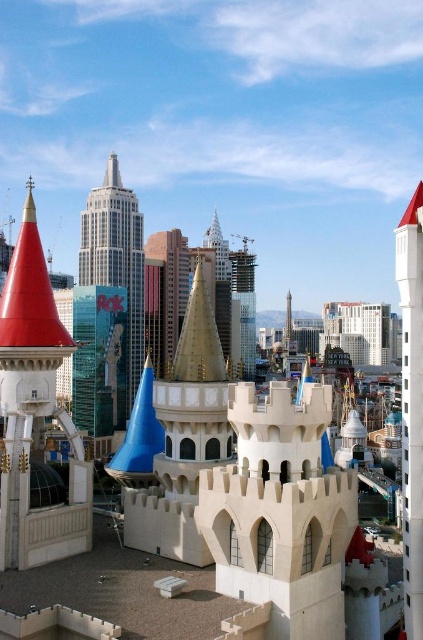
Which of these two, red matte cone at upper left or clear glass tower at center, stands taller?

Standing taller between the two is clear glass tower at center.

This screenshot has height=640, width=423. Find the location of `red matte cone at upper left`. red matte cone at upper left is located at coordinates (35, 410).

Can you confirm if white concrete tower at right is positioned above clear glass tower at center?

Incorrect, white concrete tower at right is not positioned above clear glass tower at center.

Measure the distance between white concrete tower at right and camera.

The distance of white concrete tower at right from camera is 152.07 feet.

Where is `white concrete tower at right`? This screenshot has height=640, width=423. white concrete tower at right is located at coordinates (412, 404).

Does red matte cone at upper left have a lesser height compared to white glass skyscraper at center?

Indeed, red matte cone at upper left has a lesser height compared to white glass skyscraper at center.

Locate an element on the screen. Image resolution: width=423 pixels, height=640 pixels. red matte cone at upper left is located at coordinates (35, 410).